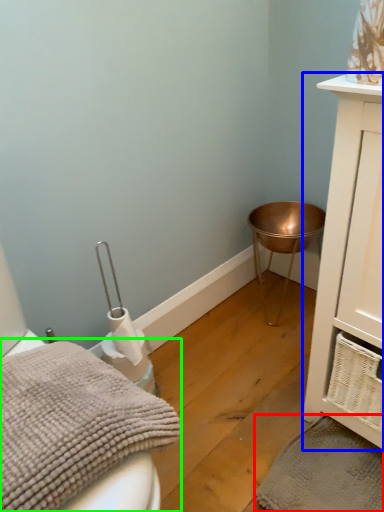
Question: Which is farther away from bath towel (highlighted by a red box)? bathroom cabinet (highlighted by a blue box) or bath towel (highlighted by a green box)?

Choices:
 (A) bathroom cabinet
 (B) bath towel

Answer: (B)